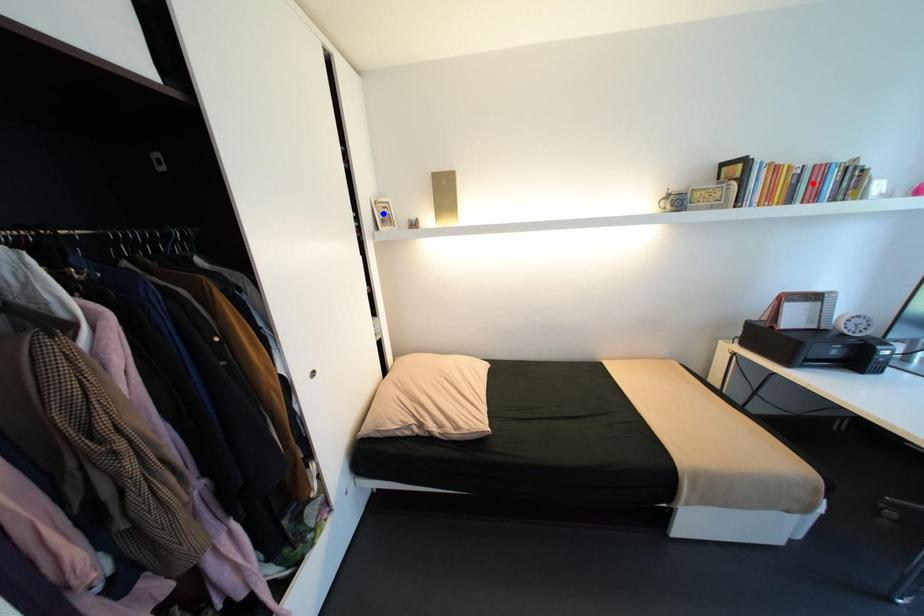
Question: Two points are marked on the image. Which point is closer to the camera?

Choices:
 (A) Blue point is closer.
 (B) Red point is closer.

Answer: (B)